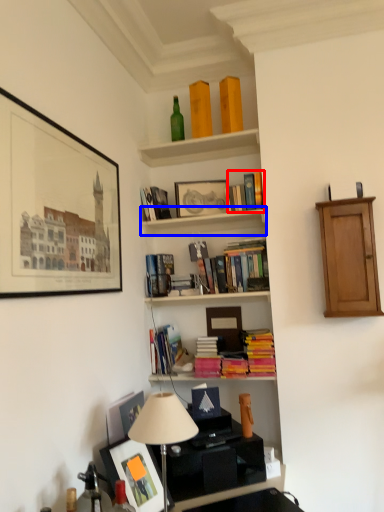
Question: Which point is further to the camera, book (highlighted by a red box) or shelf (highlighted by a blue box)?

Choices:
 (A) book
 (B) shelf

Answer: (A)